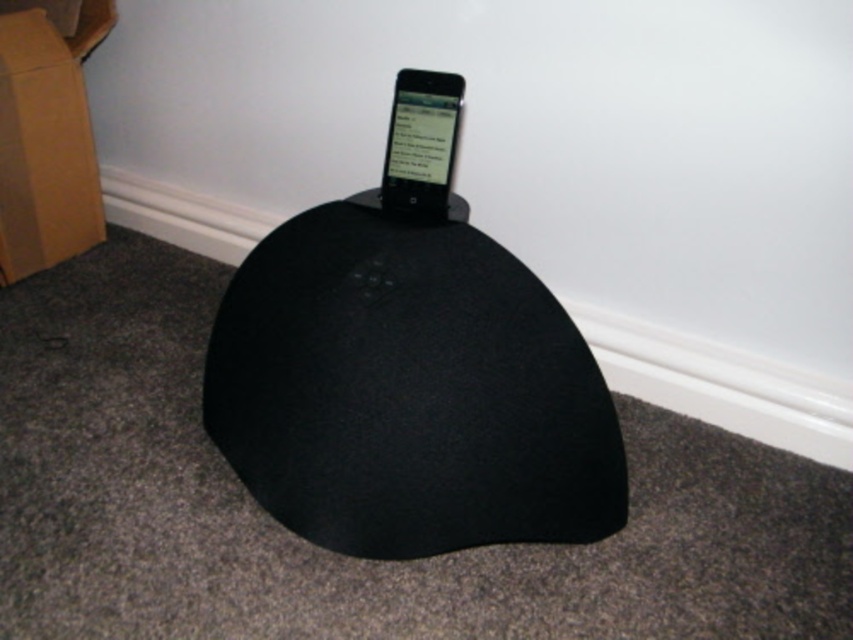
Based on the photo, between black fabric bean bag at center and brown cardboard at left, which one has more height?

brown cardboard at left

This screenshot has width=853, height=640. I want to click on black fabric bean bag at center, so click(x=408, y=388).

Does black fabric bean bag at center appear over matte black phone at center?

No.

Which is more to the left, black fabric bean bag at center or matte black phone at center?

From the viewer's perspective, black fabric bean bag at center appears more on the left side.

Identify the location of black fabric bean bag at center. (408, 388).

You are a GUI agent. You are given a task and a screenshot of the screen. Output one action in this format:
    pyautogui.click(x=<x>, y=<y>)
    Task: Click on the black fabric bean bag at center
    The height and width of the screenshot is (640, 853).
    Given the screenshot: What is the action you would take?
    pyautogui.click(x=408, y=388)

Is brown cardboard at left behind matte black phone at center?

Yes.

Who is more forward, (1, 243) or (399, 179)?

Point (399, 179) is in front.

The width and height of the screenshot is (853, 640). I want to click on brown cardboard at left, so click(45, 140).